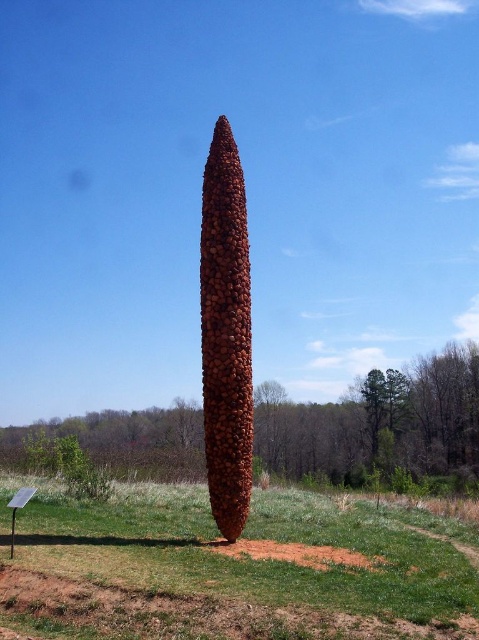
Which of these two, green grass at center or brown textured sculpture at center, stands taller?

brown textured sculpture at center

Is green grass at center above brown textured sculpture at center?

Indeed, green grass at center is positioned over brown textured sculpture at center.

I want to click on green grass at center, so click(227, 570).

Which is below, green grass at center or brown textured pine cone at center?

green grass at center

Does green grass at center have a lesser width compared to brown textured pine cone at center?

In fact, green grass at center might be wider than brown textured pine cone at center.

Measure the distance between point (x=184, y=637) and camera.

Point (x=184, y=637) and camera are 6.68 meters apart from each other.

Where is `green grass at center`? green grass at center is located at coordinates (227, 570).

This screenshot has width=479, height=640. I want to click on brown textured sculpture at center, so click(378, 422).

Does brown textured sculpture at center appear under brown textured pine cone at center?

Indeed, brown textured sculpture at center is positioned under brown textured pine cone at center.

Between point (360, 403) and point (247, 435), which one is positioned behind?

Positioned behind is point (360, 403).

Image resolution: width=479 pixels, height=640 pixels. Identify the location of brown textured sculpture at center. (378, 422).